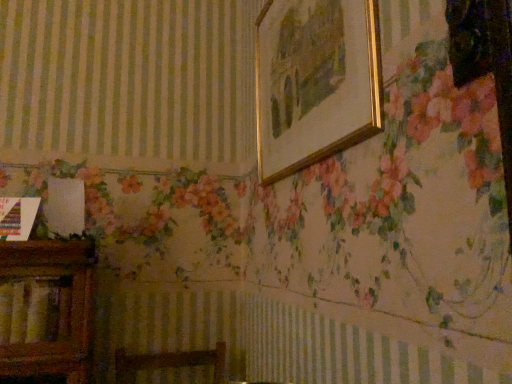
Where is `gold metallic picture frame at upper center`? gold metallic picture frame at upper center is located at coordinates (315, 82).

The width and height of the screenshot is (512, 384). What do you see at coordinates (315, 82) in the screenshot?
I see `gold metallic picture frame at upper center` at bounding box center [315, 82].

At what (x,y) coordinates should I click in order to perform the action: click on gold metallic picture frame at upper center. Please return your answer as a coordinate pair (x, y). Image resolution: width=512 pixels, height=384 pixels. Looking at the image, I should click on (x=315, y=82).